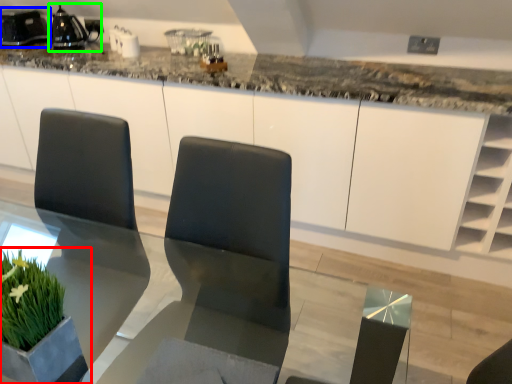
Question: Which object is the closest to the houseplant (highlighted by a red box)? Choose among these: appliance (highlighted by a blue box) or appliance (highlighted by a green box).

Choices:
 (A) appliance
 (B) appliance

Answer: (B)